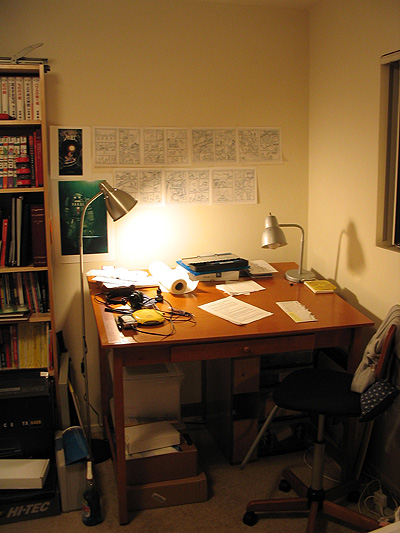
Find the location of a particular element. The width and height of the screenshot is (400, 533). wheel on bottom of desk chair is located at coordinates (250, 524), (280, 488), (352, 498).